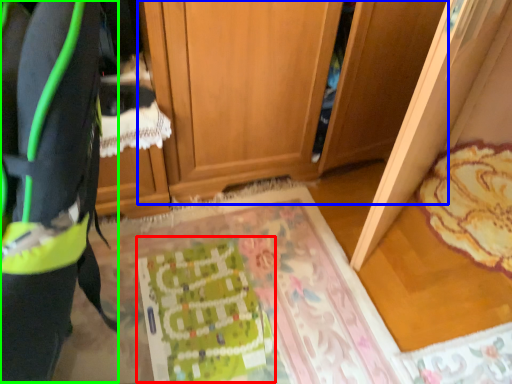
Question: Based on their relative distances, which object is nearer to wrapping paper (highlighted by a red box)? Choose from cabinetry (highlighted by a blue box) and wide (highlighted by a green box).

Choices:
 (A) cabinetry
 (B) wide

Answer: (A)